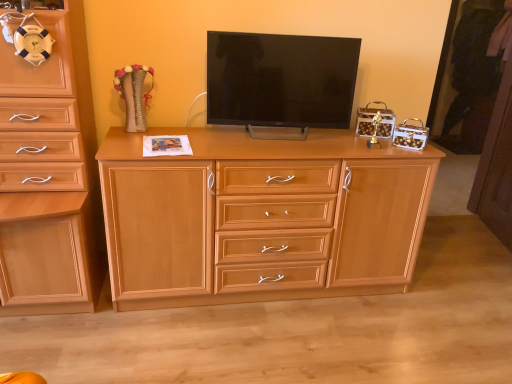
Where is `free point above light wood chest of drawers at center, placed as the second chest of drawers when sorted from left to right (from a real-world perspective)`? The image size is (512, 384). free point above light wood chest of drawers at center, placed as the second chest of drawers when sorted from left to right (from a real-world perspective) is located at coordinates (270, 142).